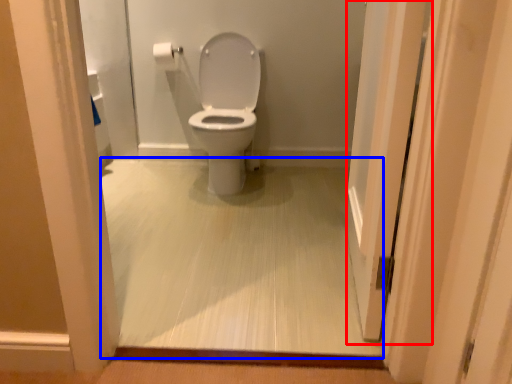
Question: Which of the following is the closest to the observer, screen door (highlighted by a red box) or corridor (highlighted by a blue box)?

Choices:
 (A) screen door
 (B) corridor

Answer: (A)